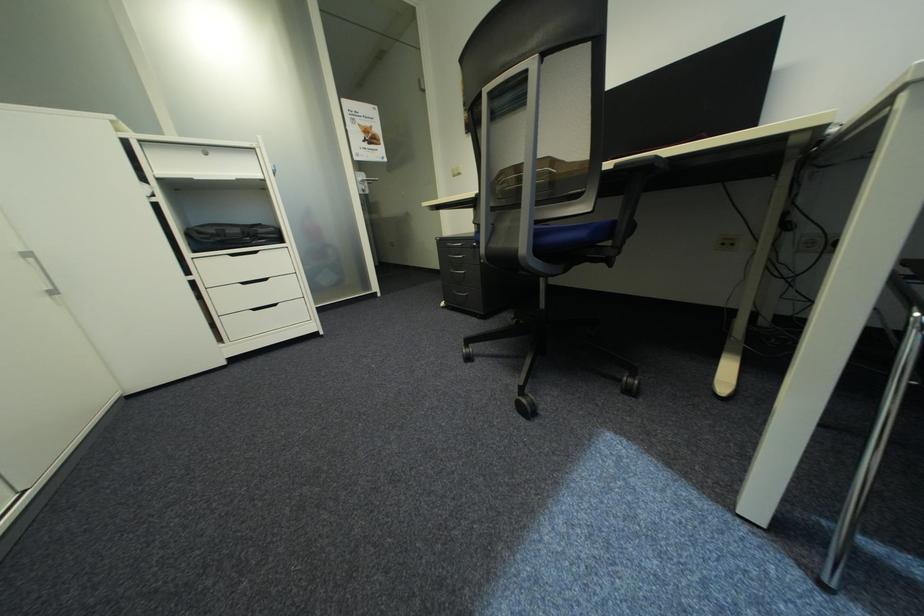
The height and width of the screenshot is (616, 924). Describe the element at coordinates (227, 237) in the screenshot. I see `the white cabinet handle` at that location.